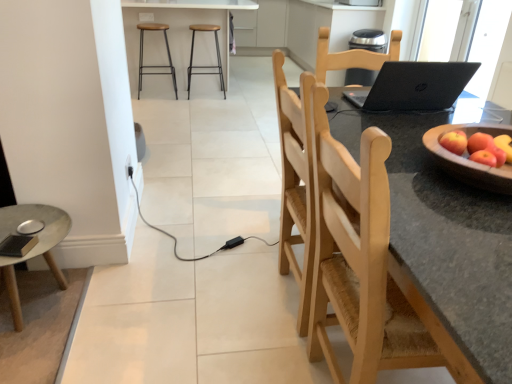
Question: Based on their positions, is matte wooden desk at lower left located to the left or right of black matte laptop at center?

Choices:
 (A) right
 (B) left

Answer: (B)

Question: Is matte wooden desk at lower left in front of or behind black matte laptop at center in the image?

Choices:
 (A) behind
 (B) front

Answer: (A)

Question: Which object is the farthest from the black matte laptop at center?

Choices:
 (A) metallic black stool at upper left, the 1th stool positioned from the left
 (B) wooden bowl at right
 (C) metallic silver barstools at upper center
 (D) wooden chair at center
 (E) black plastic outlet at lower left

Answer: (A)

Question: Based on their relative distances, which object is nearer to the wooden chair at center?

Choices:
 (A) matte wooden desk at lower left
 (B) black matte laptop at center
 (C) metallic silver barstools at upper center
 (D) wooden bowl at right
 (E) black plastic outlet at lower left

Answer: (D)